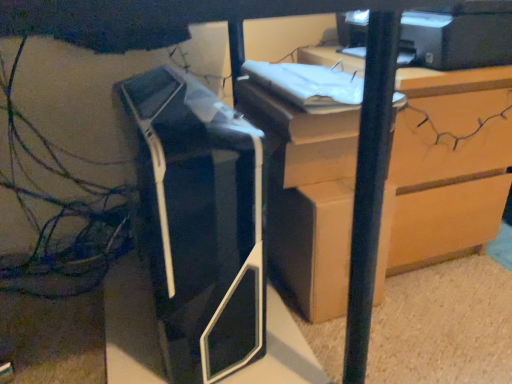
Question: Is wooden chest of drawers at upper right smaller than matte cardboard box at center?

Choices:
 (A) yes
 (B) no

Answer: (B)

Question: Is wooden chest of drawers at upper right outside of matte cardboard box at center?

Choices:
 (A) no
 (B) yes

Answer: (B)

Question: Is there a large distance between wooden chest of drawers at upper right and matte cardboard box at center?

Choices:
 (A) no
 (B) yes

Answer: (A)

Question: Is wooden chest of drawers at upper right with matte cardboard box at center?

Choices:
 (A) yes
 (B) no

Answer: (A)

Question: Does wooden chest of drawers at upper right lie behind matte cardboard box at center?

Choices:
 (A) no
 (B) yes

Answer: (B)

Question: Considering the positions of wooden chest of drawers at upper right and matte cardboard box at center in the image, is wooden chest of drawers at upper right taller or shorter than matte cardboard box at center?

Choices:
 (A) tall
 (B) short

Answer: (A)

Question: Would you say wooden chest of drawers at upper right is to the left or to the right of matte cardboard box at center in the picture?

Choices:
 (A) left
 (B) right

Answer: (B)

Question: Relative to matte cardboard box at center, is wooden chest of drawers at upper right in front or behind?

Choices:
 (A) front
 (B) behind

Answer: (B)

Question: Considering the positions of point (293, 221) and point (329, 215), is point (293, 221) closer or farther from the camera than point (329, 215)?

Choices:
 (A) farther
 (B) closer

Answer: (A)

Question: Considering the positions of matte black printer at upper right, marked as the second printer in a left-to-right arrangement, and black plastic printer at center, marked as the first printer in a bottom-to-top arrangement, in the image, is matte black printer at upper right, marked as the second printer in a left-to-right arrangement, bigger or smaller than black plastic printer at center, marked as the first printer in a bottom-to-top arrangement,?

Choices:
 (A) big
 (B) small

Answer: (B)

Question: From the image's perspective, is matte black printer at upper right, which is the 1th printer from top to bottom, positioned above or below black plastic printer at center, arranged as the 2th printer when viewed from the top?

Choices:
 (A) above
 (B) below

Answer: (A)

Question: From a real-world perspective, is matte black printer at upper right, which is the 1th printer from top to bottom, physically located above or below black plastic printer at center, marked as the first printer in a bottom-to-top arrangement?

Choices:
 (A) below
 (B) above

Answer: (B)

Question: Visually, is matte black printer at upper right, the 2th printer positioned from the bottom, positioned to the left or to the right of black plastic printer at center, marked as the first printer in a bottom-to-top arrangement?

Choices:
 (A) right
 (B) left

Answer: (A)

Question: Is black plastic printer at center, arranged as the 2th printer when viewed from the top, to the left or to the right of matte cardboard box at center in the image?

Choices:
 (A) right
 (B) left

Answer: (B)

Question: Considering the positions of black plastic printer at center, the second printer when ordered from right to left, and matte cardboard box at center in the image, is black plastic printer at center, the second printer when ordered from right to left, wider or thinner than matte cardboard box at center?

Choices:
 (A) thin
 (B) wide

Answer: (B)